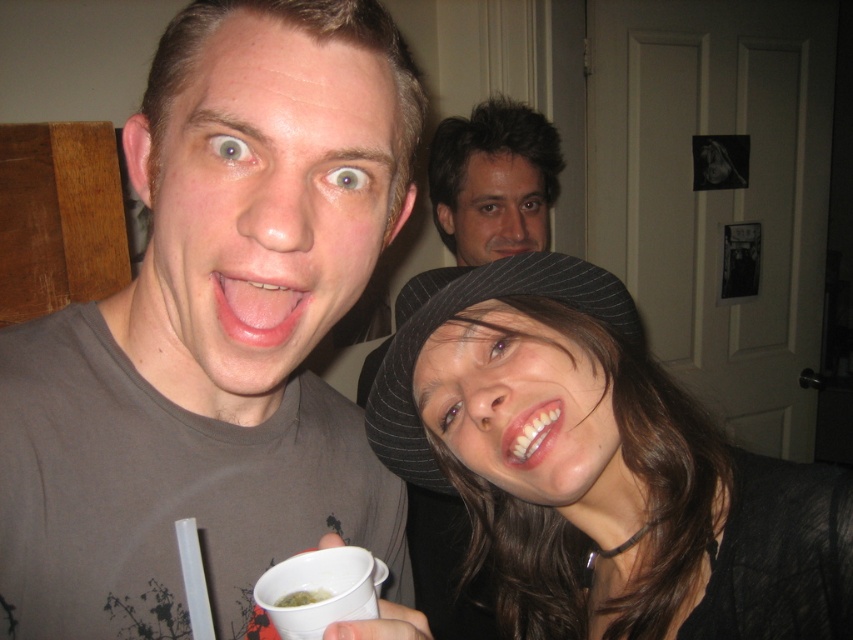
You are a photographer trying to focus on the white glossy teeth at center and the green liquid at cup center in the image. Which object should you adjust your camera focus on first if you want to capture both clearly?

You should focus on the white glossy teeth at center first because it is closer to the viewer than the green liquid at cup center, allowing you to adjust focus accordingly for both objects.

You are standing in front of the image and want to touch the two points labeled point (244, 284) and point (540, 432). Which point would require you to reach further back to touch?

Point (540, 432) would require reaching further back because it is farther from the viewer compared to point (244, 284).